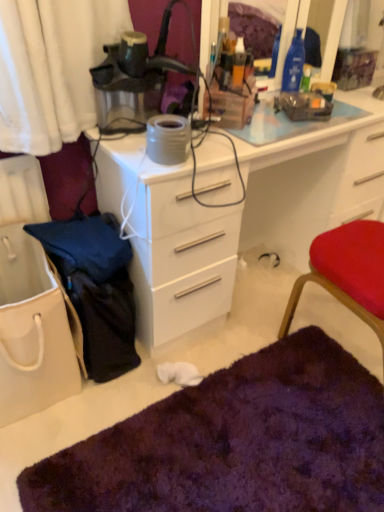
Where is `free space above white glossy desk at center (from a real-world perspective)`? Image resolution: width=384 pixels, height=512 pixels. free space above white glossy desk at center (from a real-world perspective) is located at coordinates (280, 117).